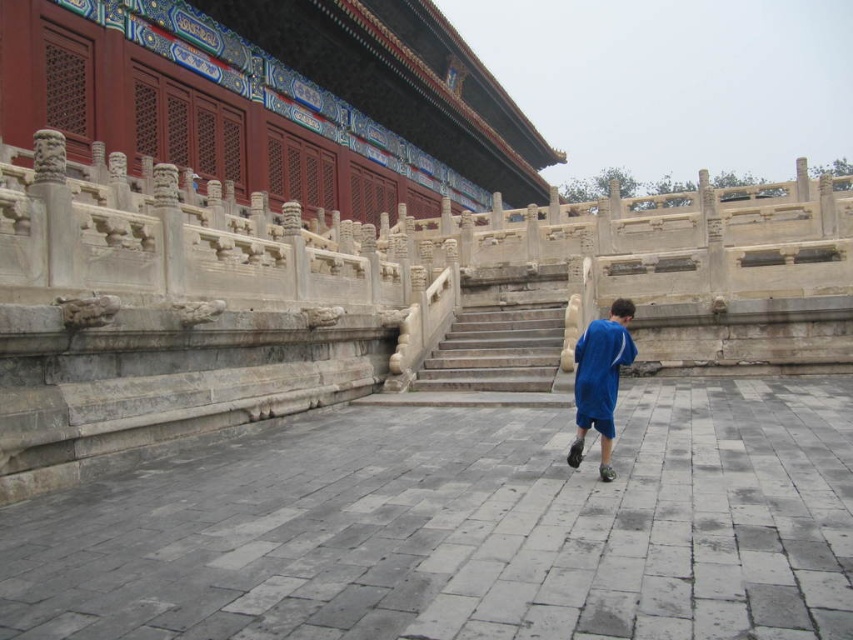
Looking at this image, you are an architect assessing the accessibility of this traditional Chinese courtyard. You notice the stone stairs at center and the blue fabric shorts at center. Which object has a greater height in the scene?

The blue fabric shorts at center has a greater height compared to the stone stairs at center.

You are standing in the courtyard of a traditional Chinese palace. You see two points marked in the scene. The first point is at coordinates point (514, 364) and the second is at point (618, 358). Which of these two points is closer to you?

A: Point (514, 364) is closer to you because it is further to the viewer than point (618, 358).

You are standing in the courtyard looking towards the stone stairs at center and the blue fabric shorts at center. Which object is positioned to the left from your perspective?

The stone stairs at center are to the left of the blue fabric shorts at center.